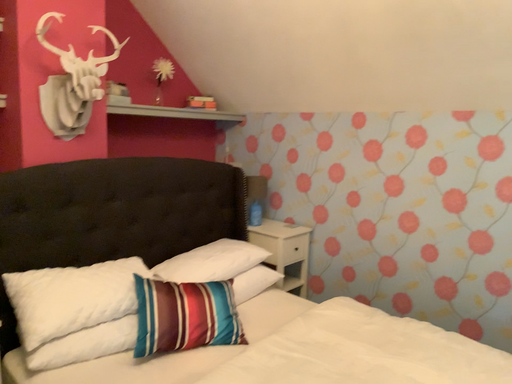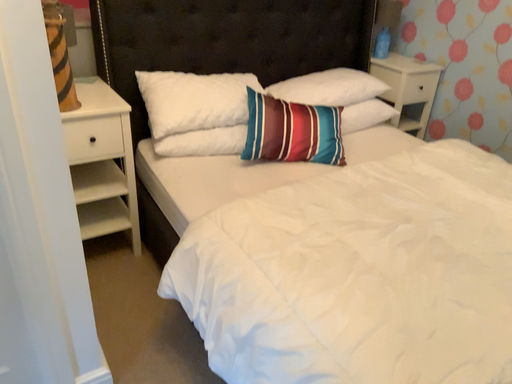
Question: Which way did the camera rotate in the video?

Choices:
 (A) rotated left
 (B) rotated right

Answer: (A)